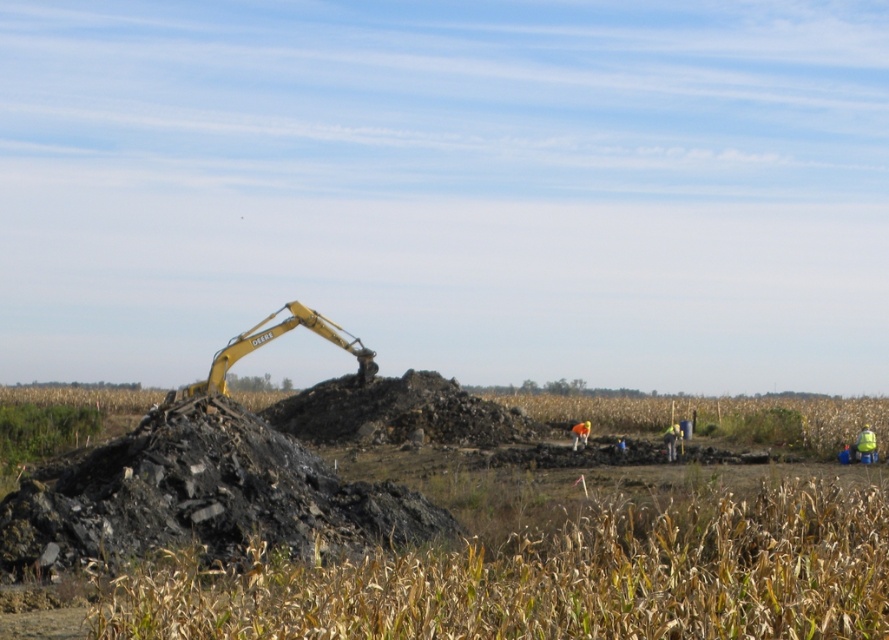
You are an inspector at the construction site and need to ensure safety equipment is properly placed. You see the yellow hard hat at center and the orange fabric at center. Which object is located to the right of the other?

The yellow hard hat at center is positioned on the right side of orange fabric at center.

Looking at this image, you are standing at the point closest to the excavator. Which of the two points, point (249, 337) or point (573, 449), is farther away from you?

Point (249, 337) is behind point (573, 449), so it is farther away from you.